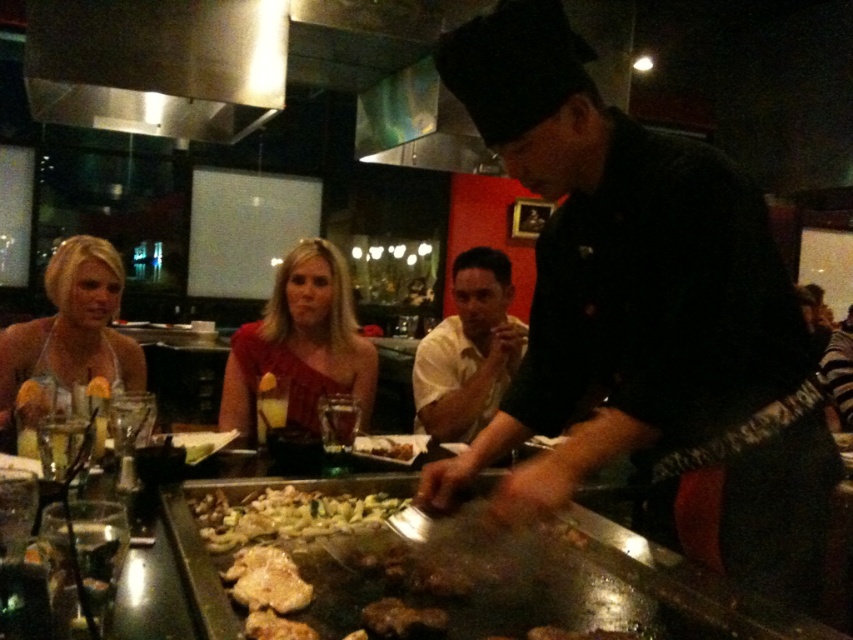
Question: Can you confirm if matte red dress at center is wider than white glossy plate at center?

Choices:
 (A) no
 (B) yes

Answer: (B)

Question: Estimate the real-world distances between objects in this image. Which object is farther from the black chef's uniform at center?

Choices:
 (A) yellow matte shirt at center
 (B) matte red dress at center
 (C) white glossy plate at center

Answer: (A)

Question: Is black chef's uniform at center bigger than white glossy plate at center?

Choices:
 (A) no
 (B) yes

Answer: (B)

Question: Does matte white dress at center appear on the right side of shiny silver pan at center?

Choices:
 (A) yes
 (B) no

Answer: (B)

Question: Which point appears closest to the camera in this image?

Choices:
 (A) (339, 531)
 (B) (91, 355)

Answer: (A)

Question: Which object appears farthest from the camera in this image?

Choices:
 (A) yellow matte shirt at center
 (B) shiny silver pan at center
 (C) metallic silver grill at center
 (D) white glossy plate at center

Answer: (A)